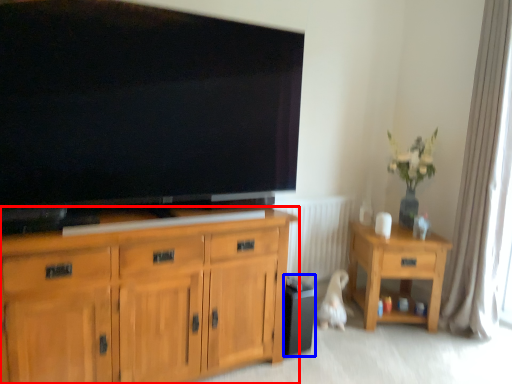
Question: Among these objects, which one is nearest to the camera, cabinetry (highlighted by a red box) or loudspeaker (highlighted by a blue box)?

Choices:
 (A) cabinetry
 (B) loudspeaker

Answer: (A)